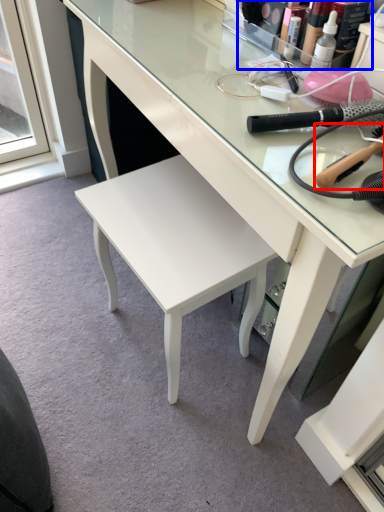
Question: Which point is further to the camera, brush (highlighted by a red box) or toiletry (highlighted by a blue box)?

Choices:
 (A) brush
 (B) toiletry

Answer: (B)